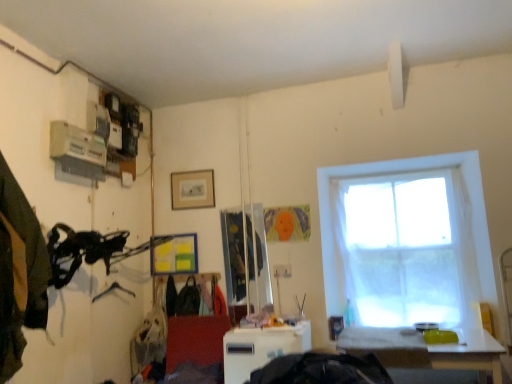
Question: Is white plastic table at center, the second table from the right, shorter than dark green fabric at left, the 3th clothing positioned from the right?

Choices:
 (A) no
 (B) yes

Answer: (B)

Question: Can you confirm if white plastic table at center, arranged as the first table when viewed from the left, is thinner than dark green fabric at left, marked as the first clothing in a front-to-back arrangement?

Choices:
 (A) no
 (B) yes

Answer: (A)

Question: From the image's perspective, does white plastic table at center, the second table from the right, appear higher than dark green fabric at left, positioned as the 3th clothing in back-to-front order?

Choices:
 (A) no
 (B) yes

Answer: (A)

Question: Is white plastic table at center, arranged as the first table when viewed from the left, positioned behind dark green fabric at left, the 3th clothing positioned from the right?

Choices:
 (A) yes
 (B) no

Answer: (A)

Question: Does white plastic table at center, arranged as the first table when viewed from the left, appear on the left side of dark green fabric at left, which is the 1th clothing from left to right?

Choices:
 (A) yes
 (B) no

Answer: (B)

Question: From their relative heights in the image, would you say white sheer curtain at right is taller or shorter than white glossy table at lower right, marked as the 1th table in a right-to-left arrangement?

Choices:
 (A) tall
 (B) short

Answer: (A)

Question: Is white sheer curtain at right inside the boundaries of white glossy table at lower right, marked as the 1th table in a right-to-left arrangement, or outside?

Choices:
 (A) outside
 (B) inside

Answer: (A)

Question: Is white sheer curtain at right wider or thinner than white glossy table at lower right, which is the second table in left-to-right order?

Choices:
 (A) thin
 (B) wide

Answer: (A)

Question: Is white sheer curtain at right bigger or smaller than white glossy table at lower right, which is the second table in left-to-right order?

Choices:
 (A) big
 (B) small

Answer: (B)

Question: In terms of height, does dark green fabric at left, which is the 1th clothing from left to right, look taller or shorter compared to matte black backpack at center, acting as the second clothing starting from the back?

Choices:
 (A) tall
 (B) short

Answer: (A)

Question: Considering the positions of dark green fabric at left, the 3th clothing positioned from the right, and matte black backpack at center, arranged as the 3th clothing when viewed from the left, in the image, is dark green fabric at left, the 3th clothing positioned from the right, bigger or smaller than matte black backpack at center, arranged as the 3th clothing when viewed from the left,?

Choices:
 (A) small
 (B) big

Answer: (B)

Question: Considering the positions of dark green fabric at left, which is the 1th clothing from left to right, and matte black backpack at center, which appears as the second clothing when viewed from the front, in the image, is dark green fabric at left, which is the 1th clothing from left to right, wider or thinner than matte black backpack at center, which appears as the second clothing when viewed from the front,?

Choices:
 (A) thin
 (B) wide

Answer: (B)

Question: Would you say dark green fabric at left, positioned as the 3th clothing in back-to-front order, is inside or outside matte black backpack at center, which appears as the second clothing when viewed from the front?

Choices:
 (A) inside
 (B) outside

Answer: (B)

Question: In terms of height, does metallic silver hanger at lower left look taller or shorter compared to black fabric bag at center, placed as the 1th clothing when sorted from back to front?

Choices:
 (A) short
 (B) tall

Answer: (A)

Question: From the image's perspective, is metallic silver hanger at lower left above or below black fabric bag at center, placed as the 1th clothing when sorted from back to front?

Choices:
 (A) below
 (B) above

Answer: (B)